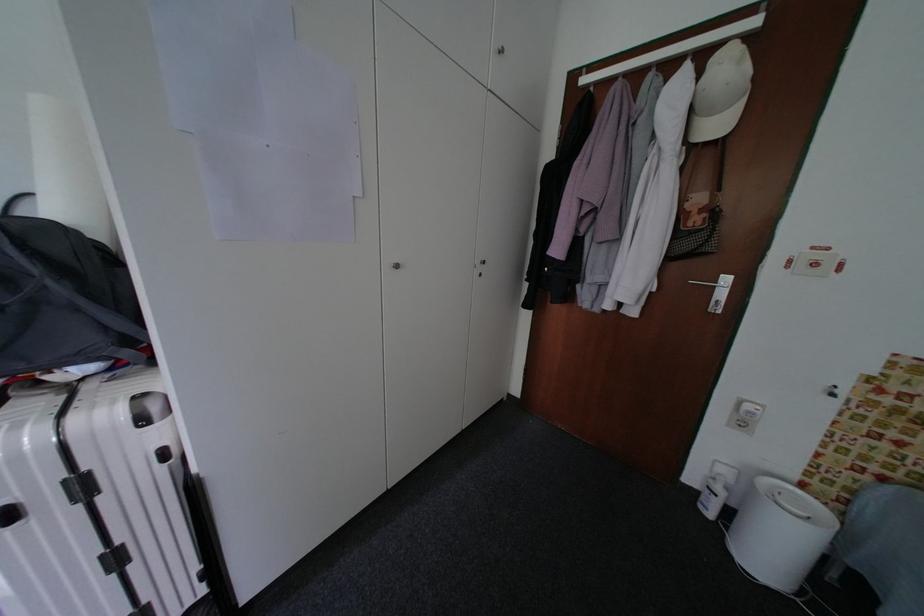
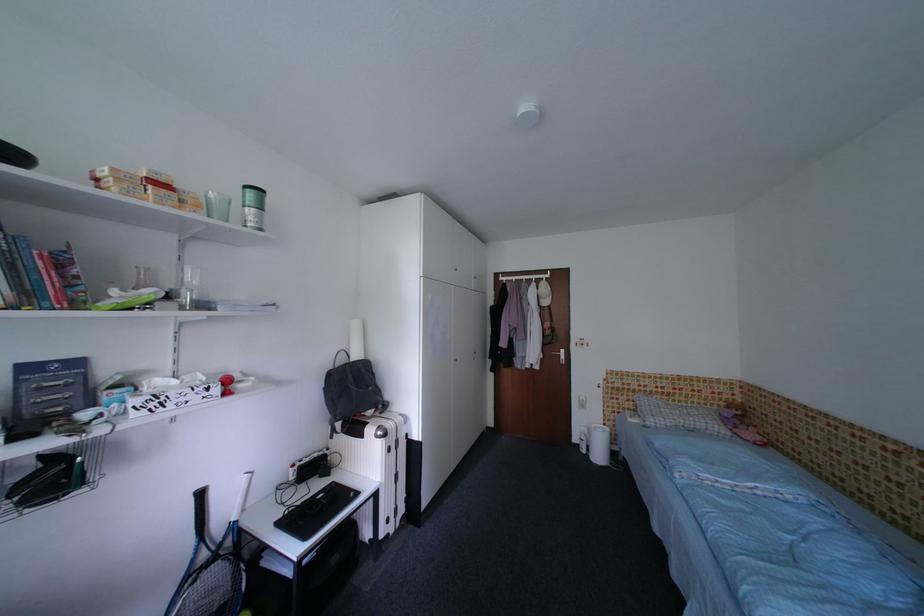
The images are taken continuously from a first-person perspective. In which direction are you moving?

The cameraman walked toward left, backward.